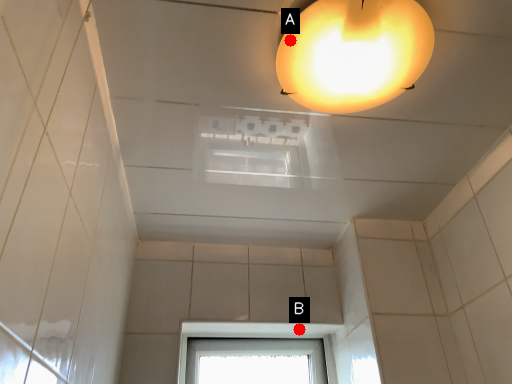
Question: Two points are circled on the image, labeled by A and B beside each circle. Which point is farther to the camera?

Choices:
 (A) A is further
 (B) B is further

Answer: (B)